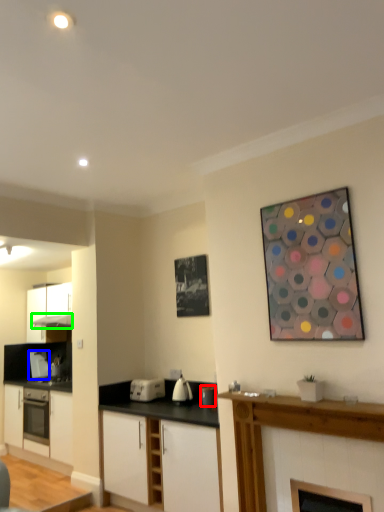
Question: Which object is the closest to the appliance (highlighted by a red box)? Choose among these: appliance (highlighted by a blue box) or exhaust hood (highlighted by a green box).

Choices:
 (A) appliance
 (B) exhaust hood

Answer: (A)